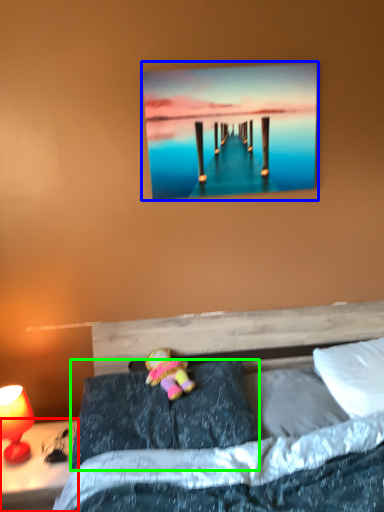
Question: Considering the real-world distances, which object is farthest from nightstand (highlighted by a red box)? picture frame (highlighted by a blue box) or pillow (highlighted by a green box)?

Choices:
 (A) picture frame
 (B) pillow

Answer: (A)